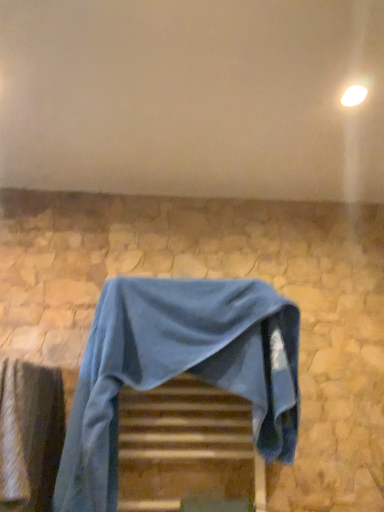
Question: Is wooden at center outside smooth stone wall at upper center?

Choices:
 (A) yes
 (B) no

Answer: (A)

Question: Is wooden at center not close to smooth stone wall at upper center?

Choices:
 (A) no
 (B) yes

Answer: (A)

Question: Can you confirm if wooden at center is wider than smooth stone wall at upper center?

Choices:
 (A) no
 (B) yes

Answer: (A)

Question: Does wooden at center have a smaller size compared to smooth stone wall at upper center?

Choices:
 (A) no
 (B) yes

Answer: (B)

Question: Could you tell me if wooden at center is facing smooth stone wall at upper center?

Choices:
 (A) no
 (B) yes

Answer: (A)

Question: Is wooden at center to the right of smooth stone wall at upper center from the viewer's perspective?

Choices:
 (A) no
 (B) yes

Answer: (A)

Question: Is blue fabric-covered chair at center turned away from wooden at center?

Choices:
 (A) yes
 (B) no

Answer: (A)

Question: Can you see blue fabric-covered chair at center touching wooden at center?

Choices:
 (A) yes
 (B) no

Answer: (B)

Question: Considering the relative sizes of blue fabric-covered chair at center and wooden at center in the image provided, is blue fabric-covered chair at center wider than wooden at center?

Choices:
 (A) yes
 (B) no

Answer: (A)

Question: Is blue fabric-covered chair at center aimed at wooden at center?

Choices:
 (A) yes
 (B) no

Answer: (A)

Question: Is blue fabric-covered chair at center smaller than wooden at center?

Choices:
 (A) yes
 (B) no

Answer: (B)

Question: Can you confirm if blue fabric-covered chair at center is positioned to the right of wooden at center?

Choices:
 (A) yes
 (B) no

Answer: (B)

Question: From a real-world perspective, is wooden at center on blue fabric-covered chair at center?

Choices:
 (A) yes
 (B) no

Answer: (B)